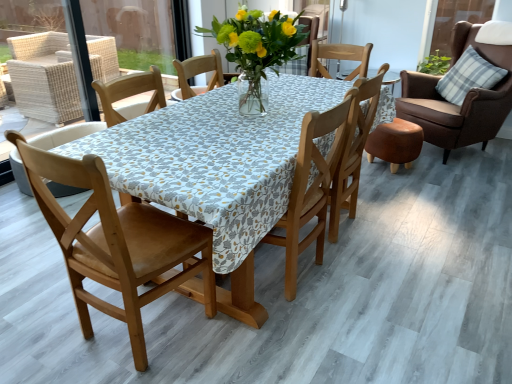
Question: Is plaid fabric pillow at upper right positioned with its back to translucent glass vase at center?

Choices:
 (A) no
 (B) yes

Answer: (A)

Question: From a real-world perspective, is plaid fabric pillow at upper right on translucent glass vase at center?

Choices:
 (A) yes
 (B) no

Answer: (B)

Question: Can you confirm if plaid fabric pillow at upper right is wider than translucent glass vase at center?

Choices:
 (A) yes
 (B) no

Answer: (B)

Question: From the image's perspective, is plaid fabric pillow at upper right located above translucent glass vase at center?

Choices:
 (A) no
 (B) yes

Answer: (B)

Question: Would you say plaid fabric pillow at upper right is outside translucent glass vase at center?

Choices:
 (A) no
 (B) yes

Answer: (B)

Question: Does plaid fabric pillow at upper right lie behind translucent glass vase at center?

Choices:
 (A) no
 (B) yes

Answer: (B)

Question: Considering the relative sizes of wooden chair at center, placed as the third chair when sorted from right to left, and plaid fabric pillow at upper right in the image provided, is wooden chair at center, placed as the third chair when sorted from right to left, bigger than plaid fabric pillow at upper right?

Choices:
 (A) yes
 (B) no

Answer: (A)

Question: From a real-world perspective, is wooden chair at center, placed as the third chair when sorted from right to left, located beneath plaid fabric pillow at upper right?

Choices:
 (A) no
 (B) yes

Answer: (B)

Question: Considering the relative sizes of wooden chair at center, placed as the third chair when sorted from right to left, and plaid fabric pillow at upper right in the image provided, is wooden chair at center, placed as the third chair when sorted from right to left, taller than plaid fabric pillow at upper right?

Choices:
 (A) yes
 (B) no

Answer: (A)

Question: From the image's perspective, is wooden chair at center, placed as the third chair when sorted from right to left, above plaid fabric pillow at upper right?

Choices:
 (A) yes
 (B) no

Answer: (B)

Question: Is wooden chair at center, placed as the third chair when sorted from right to left, to the left of plaid fabric pillow at upper right from the viewer's perspective?

Choices:
 (A) no
 (B) yes

Answer: (B)

Question: Is wooden chair at center, placed as the third chair when sorted from right to left, next to plaid fabric pillow at upper right and touching it?

Choices:
 (A) no
 (B) yes

Answer: (A)

Question: From the image's perspective, is brown leather chair at upper right, positioned as the 5th chair in left-to-right order, beneath plaid fabric pillow at upper right?

Choices:
 (A) yes
 (B) no

Answer: (A)